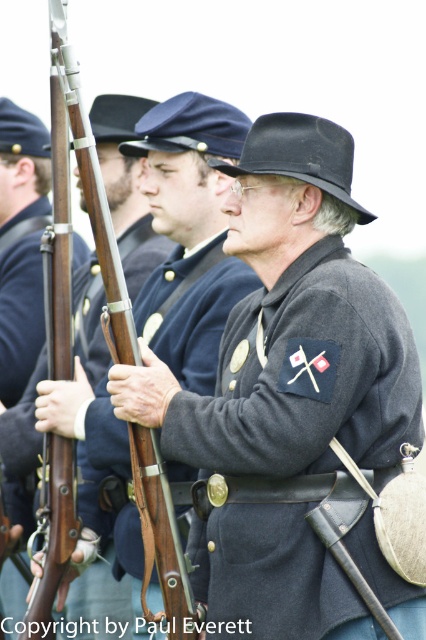
Does dark gray wool jacket at center have a lesser height compared to matte gray uniform at center?

Incorrect, dark gray wool jacket at center's height does not fall short of matte gray uniform at center's.

Which is more to the left, dark gray wool jacket at center or matte gray uniform at center?

matte gray uniform at center

Identify the location of dark gray wool jacket at center. This screenshot has height=640, width=426. [305, 380].

Does matte gray uniform at center have a lesser height compared to wooden rifle at center?

Yes.

Which is in front, point (180, 99) or point (5, 128)?

Positioned in front is point (180, 99).

Between point (152, 138) and point (16, 179), which one is positioned behind?

Point (16, 179)

Find the location of `matte gray uniform at center`. matte gray uniform at center is located at coordinates (189, 234).

Looking at this image, can you confirm if dark gray wool jacket at center is positioned to the left of wooden rifle at center?

Incorrect, dark gray wool jacket at center is not on the left side of wooden rifle at center.

How much distance is there between dark gray wool jacket at center and wooden rifle at center?

dark gray wool jacket at center and wooden rifle at center are 22.07 feet apart from each other.

The width and height of the screenshot is (426, 640). What do you see at coordinates (305, 380) in the screenshot?
I see `dark gray wool jacket at center` at bounding box center [305, 380].

Image resolution: width=426 pixels, height=640 pixels. In order to click on dark gray wool jacket at center in this screenshot , I will do (305, 380).